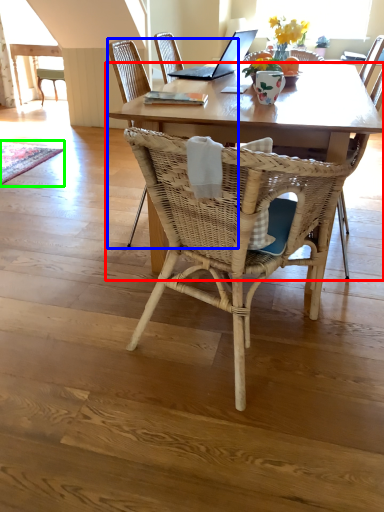
Question: Considering the real-world distances, which object is farthest from coffee table (highlighted by a red box)? chair (highlighted by a blue box) or mat (highlighted by a green box)?

Choices:
 (A) chair
 (B) mat

Answer: (B)